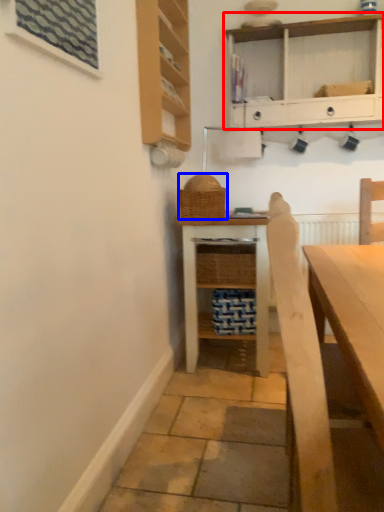
Question: Which object appears closest to the camera in this image, shelf (highlighted by a red box) or basket (highlighted by a blue box)?

Choices:
 (A) shelf
 (B) basket

Answer: (B)